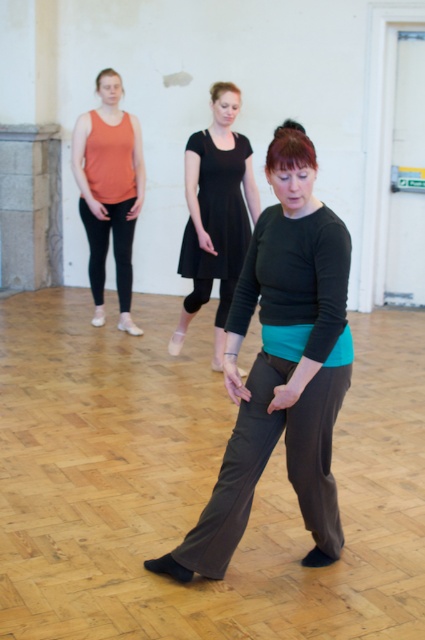
Question: Is black matte dress at center smaller than matte orange tank top at left?

Choices:
 (A) yes
 (B) no

Answer: (B)

Question: Among these points, which one is farthest from the camera?

Choices:
 (A) (x=300, y=364)
 (B) (x=87, y=152)
 (C) (x=221, y=129)

Answer: (B)

Question: Does matte black top at center appear over matte orange tank top at left?

Choices:
 (A) no
 (B) yes

Answer: (A)

Question: Considering the real-world distances, which object is closest to the black matte dress at center?

Choices:
 (A) matte orange tank top at left
 (B) matte black top at center

Answer: (A)

Question: Can you confirm if matte black top at center is positioned to the left of matte orange tank top at left?

Choices:
 (A) no
 (B) yes

Answer: (A)

Question: Which object appears farthest from the camera in this image?

Choices:
 (A) matte black top at center
 (B) black matte dress at center
 (C) matte orange tank top at left

Answer: (C)